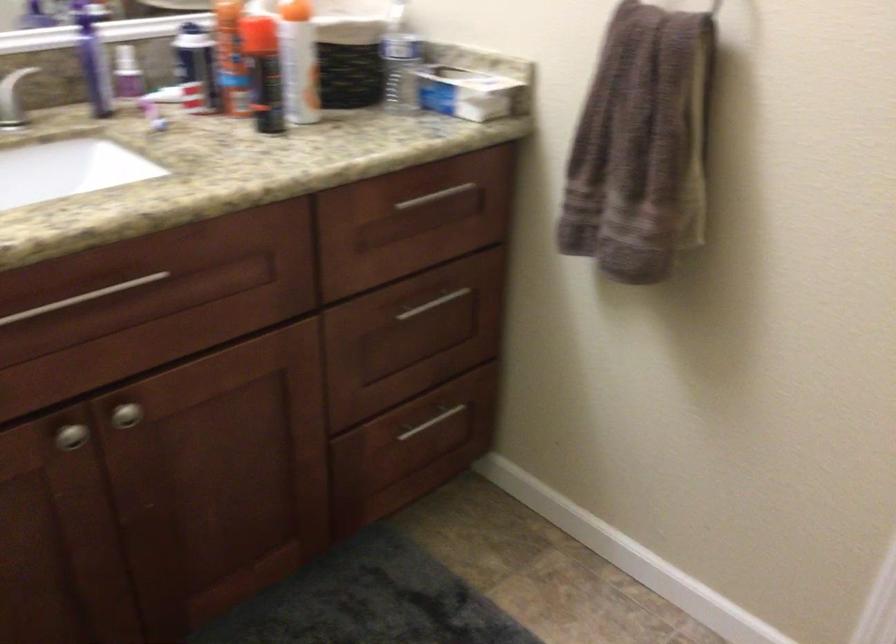
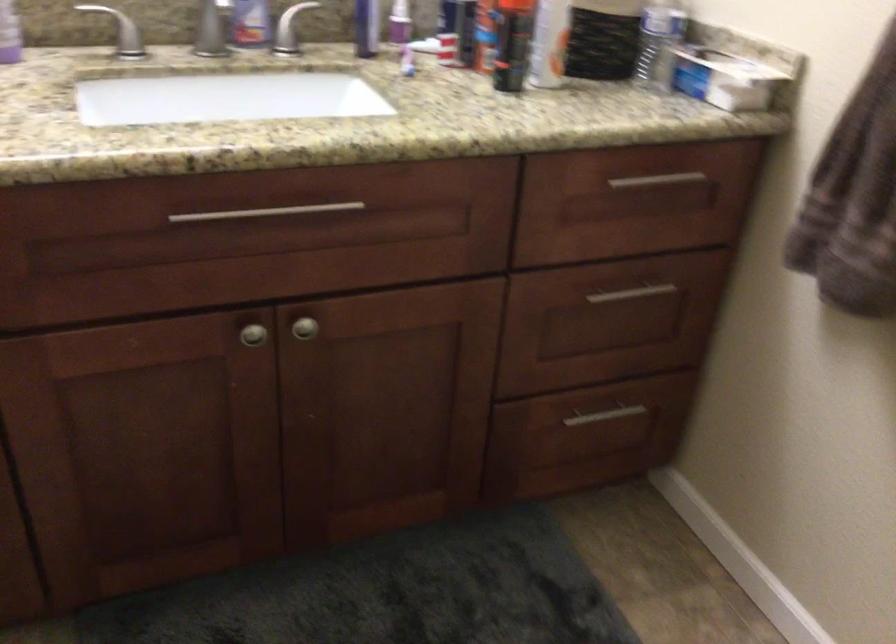
Question: The images are taken continuously from a first-person perspective. In which direction is your viewpoint rotating?

Choices:
 (A) Left
 (B) Right
 (C) Up
 (D) Down

Answer: (A)